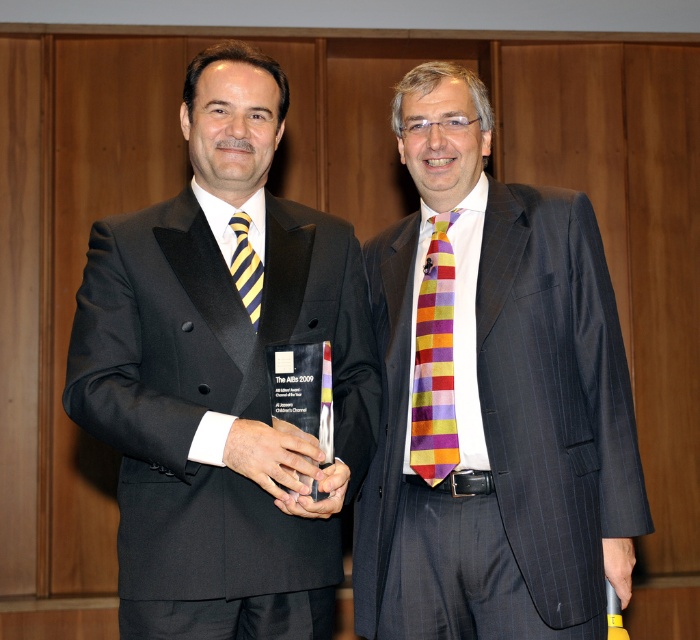
Locate an element on the screen. This screenshot has height=640, width=700. multicolored striped tie at center is located at coordinates (434, 360).

Identify the location of multicolored striped tie at center. (434, 360).

Between striped silk tie at center and yellow striped tie at left, which one has less height?

Standing shorter between the two is yellow striped tie at left.

Which is behind, point (462, 484) or point (244, 294)?

Positioned behind is point (462, 484).

The image size is (700, 640). Identify the location of striped silk tie at center. (491, 397).

Does striped silk tie at center appear over multicolored striped tie at center?

Incorrect, striped silk tie at center is not positioned above multicolored striped tie at center.

Can you confirm if striped silk tie at center is bigger than multicolored striped tie at center?

Indeed, striped silk tie at center has a larger size compared to multicolored striped tie at center.

At what (x,y) coordinates should I click in order to perform the action: click on striped silk tie at center. Please return your answer as a coordinate pair (x, y). The height and width of the screenshot is (640, 700). Looking at the image, I should click on (491, 397).